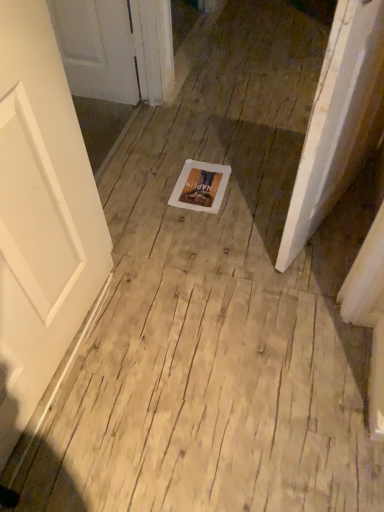
Locate an element on the screen. Image resolution: width=384 pixels, height=512 pixels. blank space situated above light brown wood floor at center (from a real-world perspective) is located at coordinates (195, 395).